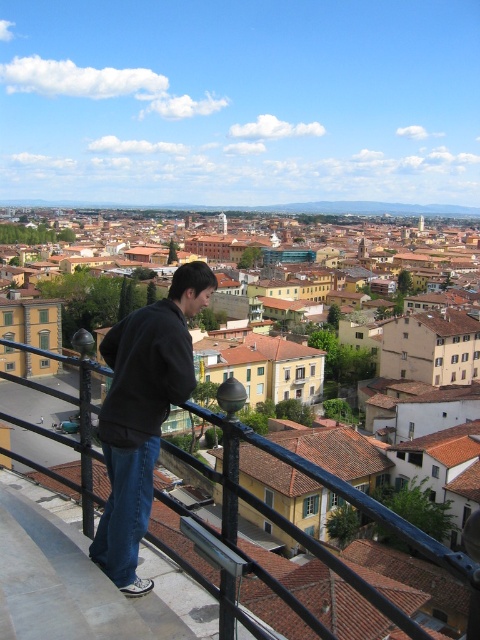
You are a fashion designer observing the city scene. You notice the dark gray hoodie at center and denim at left. Which clothing item is covering part of the other?

The dark gray hoodie at center is positioned over denim at left, so it is covering part of the denim at left.